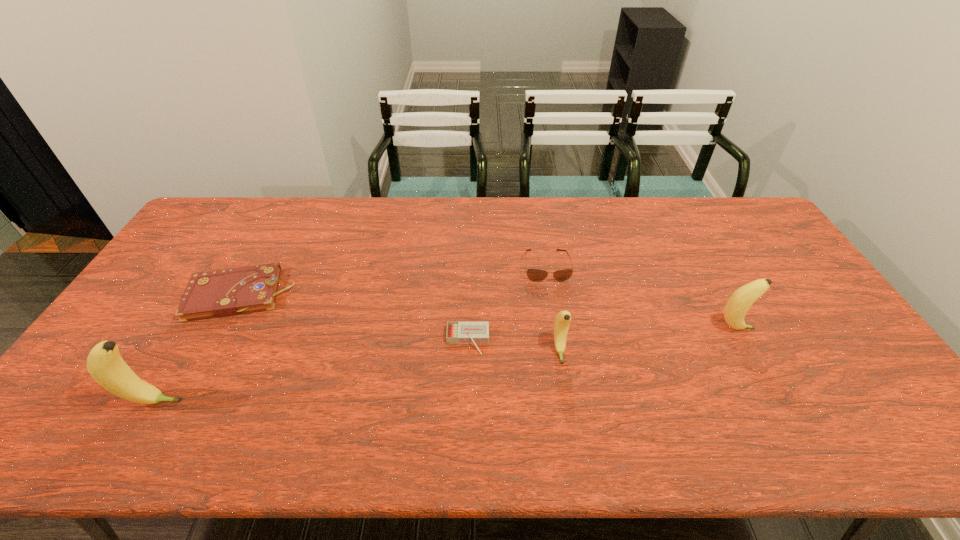
Identify the location of vacant space at the far edge of the desktop. (545, 222).

Locate an element on the screen. Image resolution: width=960 pixels, height=540 pixels. free space at the near edge of the desktop is located at coordinates pos(427,388).

Locate an element on the screen. Image resolution: width=960 pixels, height=540 pixels. vacant region at the left edge is located at coordinates (132, 333).

Locate an element on the screen. vacant space at the far left corner of the desktop is located at coordinates (243, 216).

In the image, there is a desktop. Identify the location of vacant space at the far right corner. This screenshot has height=540, width=960. (747, 207).

Where is `empty space between the nearest banana and the notebook`? The image size is (960, 540). empty space between the nearest banana and the notebook is located at coordinates (197, 348).

I want to click on free spot between the shortest banana and the rightmost object, so click(x=647, y=340).

Identify the location of unoccupied position between the shortest banana and the rightmost banana. (647, 340).

Image resolution: width=960 pixels, height=540 pixels. Find the location of `free space between the fourth tallest object and the rightmost object`. free space between the fourth tallest object and the rightmost object is located at coordinates (640, 298).

The image size is (960, 540). I want to click on vacant space that's between the notebook and the second tallest object, so click(x=488, y=312).